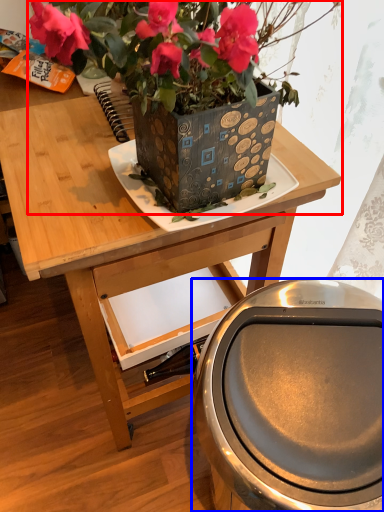
Question: Which object is closer to the camera taking this photo, houseplant (highlighted by a red box) or potty (highlighted by a blue box)?

Choices:
 (A) houseplant
 (B) potty

Answer: (A)